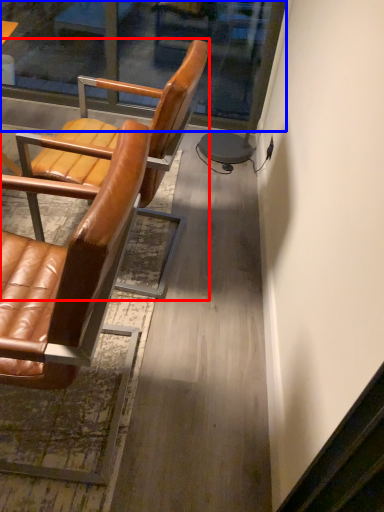
Question: Which object is further to the camera taking this photo, chair (highlighted by a red box) or glass door (highlighted by a blue box)?

Choices:
 (A) chair
 (B) glass door

Answer: (B)